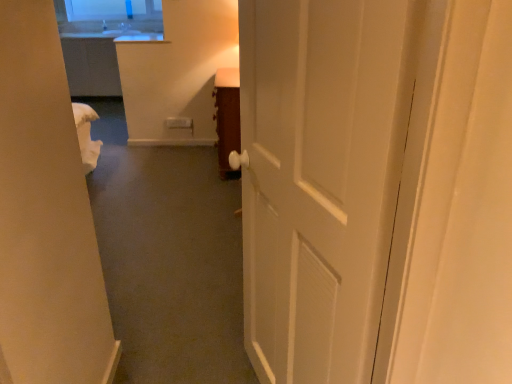
Question: From a real-world perspective, is wooden cabinet at center beneath white glossy door at center?

Choices:
 (A) no
 (B) yes

Answer: (B)

Question: Does wooden cabinet at center have a lesser width compared to white glossy door at center?

Choices:
 (A) no
 (B) yes

Answer: (A)

Question: Is wooden cabinet at center outside of white glossy door at center?

Choices:
 (A) no
 (B) yes

Answer: (B)

Question: From a real-world perspective, is wooden cabinet at center located higher than white glossy door at center?

Choices:
 (A) no
 (B) yes

Answer: (A)

Question: From the image's perspective, is wooden cabinet at center under white glossy door at center?

Choices:
 (A) no
 (B) yes

Answer: (A)

Question: Are wooden cabinet at center and white glossy door at center making contact?

Choices:
 (A) yes
 (B) no

Answer: (B)

Question: From the image's perspective, does white glossy door at center appear lower than wooden cabinet at center?

Choices:
 (A) no
 (B) yes

Answer: (B)

Question: Is white glossy door at center taller than wooden cabinet at center?

Choices:
 (A) yes
 (B) no

Answer: (A)

Question: Does white glossy door at center touch wooden cabinet at center?

Choices:
 (A) no
 (B) yes

Answer: (A)

Question: Is white glossy door at center behind wooden cabinet at center?

Choices:
 (A) yes
 (B) no

Answer: (B)

Question: Is wooden cabinet at center a part of white glossy door at center?

Choices:
 (A) yes
 (B) no

Answer: (B)

Question: Does white glossy door at center have a lesser width compared to wooden cabinet at center?

Choices:
 (A) yes
 (B) no

Answer: (A)

Question: Is point (336, 105) closer or farther from the camera than point (225, 145)?

Choices:
 (A) closer
 (B) farther

Answer: (A)